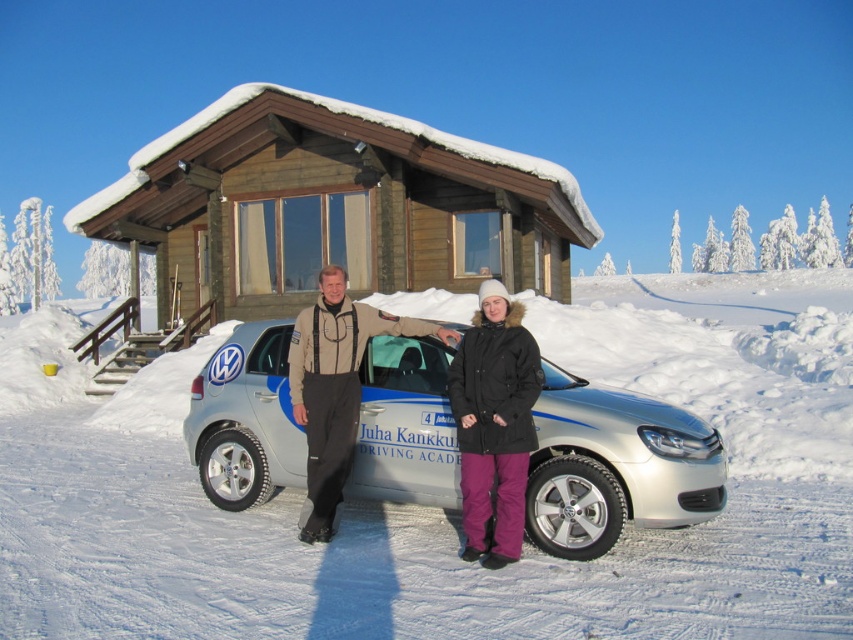
You are standing at the entrance of the wooden cabin and want to walk to the car parked in front of it. Which point, point (448, 177) or point (556, 484), is closer to your starting position?

Point (556, 484) is closer to your starting position because it is in front of point (448, 177).